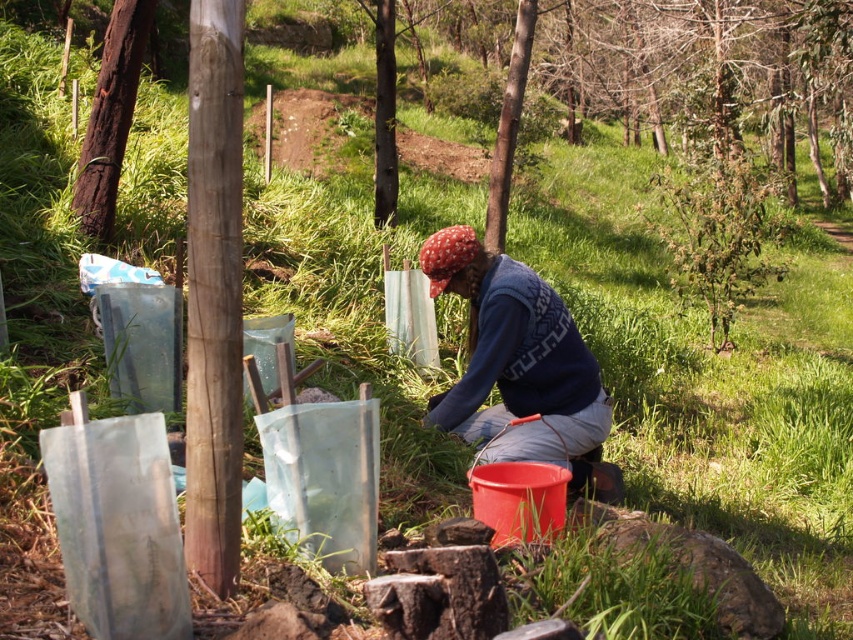
Can you confirm if blue knitted sweater at center is positioned to the left of corky bark tree at left?

In fact, blue knitted sweater at center is to the right of corky bark tree at left.

Consider the image. Between blue knitted sweater at center and corky bark tree at left, which one appears on the left side from the viewer's perspective?

corky bark tree at left

Does point (582, 451) come closer to viewer compared to point (120, 102)?

Yes, it is in front of point (120, 102).

Where is `blue knitted sweater at center`? The height and width of the screenshot is (640, 853). blue knitted sweater at center is located at coordinates (519, 365).